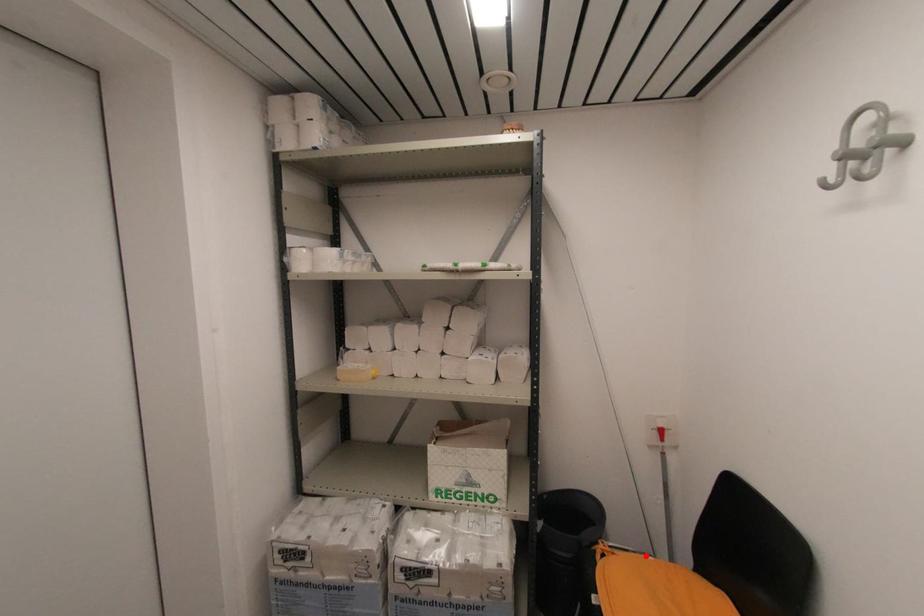
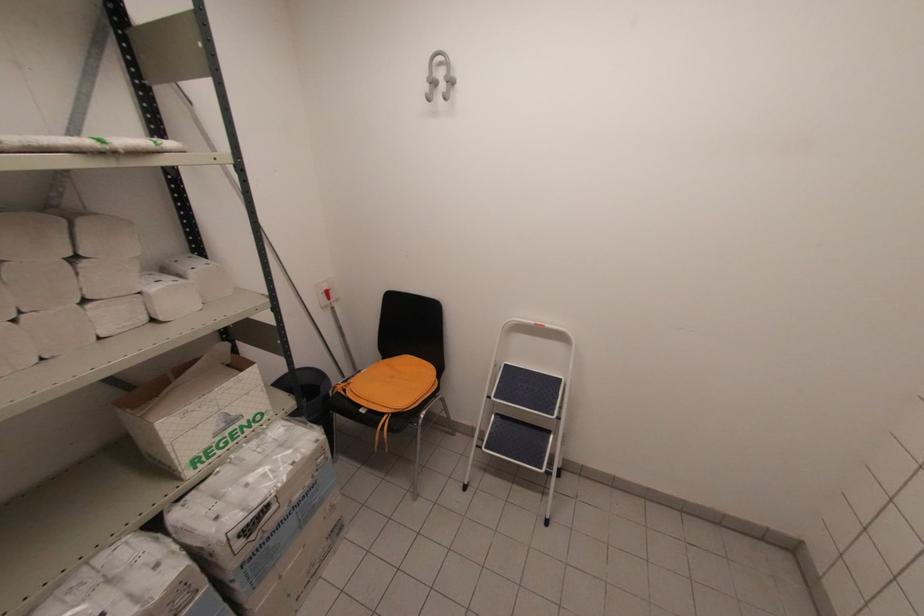
The point at the highlighted location is marked in the first image. Where is the corresponding point in the second image?

(362, 371)